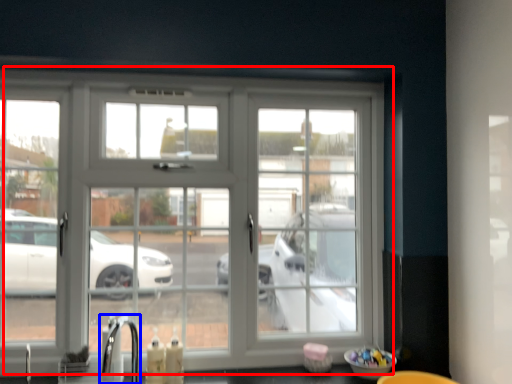
Question: Which object is closer to the camera taking this photo, window (highlighted by a red box) or faucet (highlighted by a blue box)?

Choices:
 (A) window
 (B) faucet

Answer: (B)